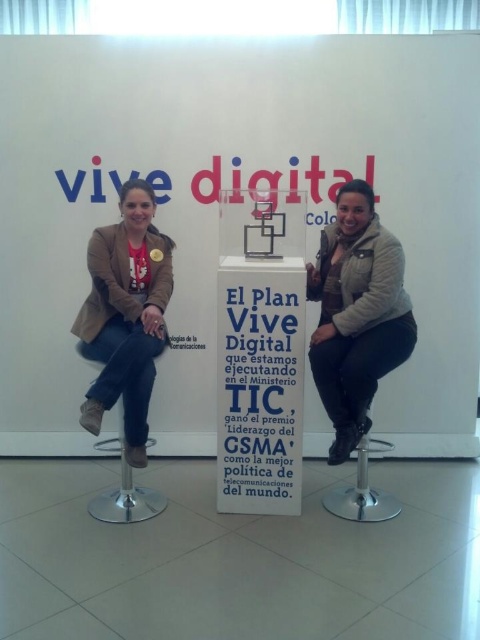
Is matte beige jacket at left shorter than gold metallic medal at center?

Incorrect, matte beige jacket at left's height does not fall short of gold metallic medal at center's.

Does matte beige jacket at left have a smaller size compared to gold metallic medal at center?

A: No.

Is point (146, 355) less distant than point (155, 248)?

Yes, it is.

This screenshot has width=480, height=640. I want to click on matte beige jacket at left, so click(124, 316).

Is matte beige jacket at center smaller than metallic silver bar stool at left?

Indeed, matte beige jacket at center has a smaller size compared to metallic silver bar stool at left.

Who is more forward, (379, 304) or (156, 508)?

Point (379, 304) is more forward.

Where is `matte beige jacket at center`? matte beige jacket at center is located at coordinates (357, 314).

Does point (354, 180) come behind point (152, 259)?

No, it is in front of (152, 259).

Is matte beige jacket at center closer to camera compared to gold metallic medal at center?

Yes, matte beige jacket at center is in front of gold metallic medal at center.

Who is more forward, (415,324) or (149,252)?

Point (415,324) is in front.

The image size is (480, 640). Find the location of `matte beige jacket at center`. matte beige jacket at center is located at coordinates (357, 314).